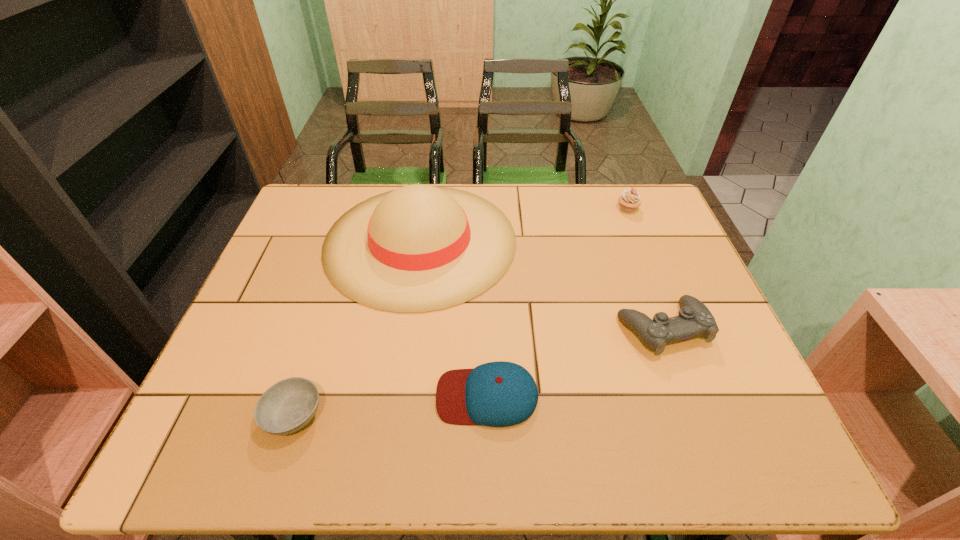
At what (x,y) coordinates should I click in order to perform the action: click on object that is at the far left corner. Please return your answer as a coordinate pair (x, y). The height and width of the screenshot is (540, 960). Looking at the image, I should click on (419, 248).

Find the location of a particular element. This screenshot has height=540, width=960. object that is at the near left corner is located at coordinates (287, 406).

The image size is (960, 540). In order to click on object that is at the far right corner in this screenshot , I will do 630,199.

Locate an element on the screen. This screenshot has width=960, height=540. vacant space at the far edge of the desktop is located at coordinates tap(570, 186).

At what (x,y) coordinates should I click in order to perform the action: click on free spot at the near edge of the desktop. Please return your answer as a coordinate pair (x, y). The height and width of the screenshot is (540, 960). Looking at the image, I should click on point(575,423).

Find the location of `vacant space at the left edge of the desktop`. vacant space at the left edge of the desktop is located at coordinates (227, 354).

Where is `vacant space at the right edge`? The width and height of the screenshot is (960, 540). vacant space at the right edge is located at coordinates (709, 303).

Find the location of a particular element. free space at the far left corner is located at coordinates (319, 217).

Where is `vacant area at the near left corner`? vacant area at the near left corner is located at coordinates (201, 450).

The width and height of the screenshot is (960, 540). Find the location of `free area in between the cupcake and the control`. free area in between the cupcake and the control is located at coordinates click(x=645, y=268).